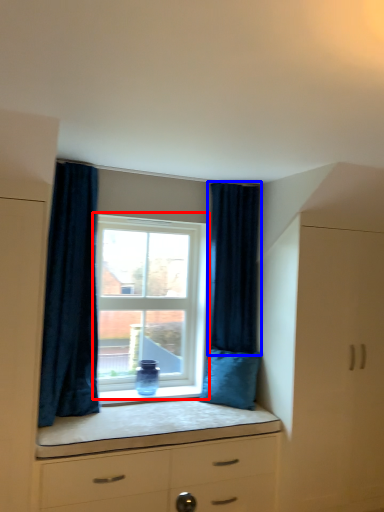
Question: Which of the following is the farthest to the observer, window (highlighted by a red box) or curtain (highlighted by a blue box)?

Choices:
 (A) window
 (B) curtain

Answer: (A)